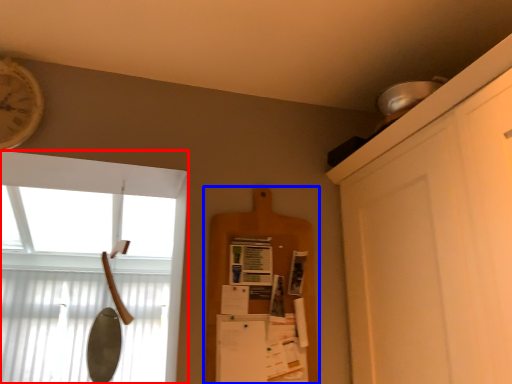
Question: Which object appears farthest to the camera in this image, window (highlighted by a red box) or shelf (highlighted by a blue box)?

Choices:
 (A) window
 (B) shelf

Answer: (B)